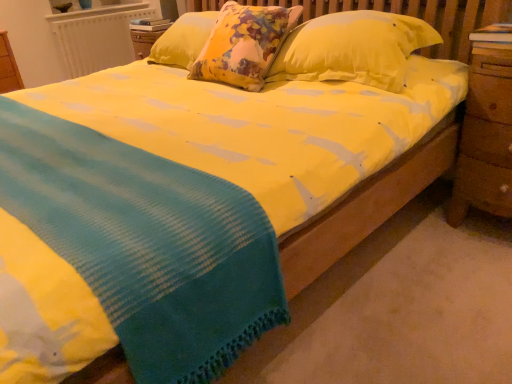
Question: In terms of height, does yellow cotton blanket at center look taller or shorter compared to yellow fabric pillow at center?

Choices:
 (A) short
 (B) tall

Answer: (A)

Question: From the image's perspective, is yellow cotton blanket at center located above or below yellow fabric pillow at center?

Choices:
 (A) below
 (B) above

Answer: (A)

Question: Which of these objects is positioned farthest from the wooden at right?

Choices:
 (A) yellow cotton blanket at center
 (B) white textured radiator at upper left
 (C) yellow fabric pillow at center

Answer: (B)

Question: Considering the real-world distances, which object is closest to the yellow cotton blanket at center?

Choices:
 (A) wooden at right
 (B) white textured radiator at upper left
 (C) yellow fabric pillow at center

Answer: (C)